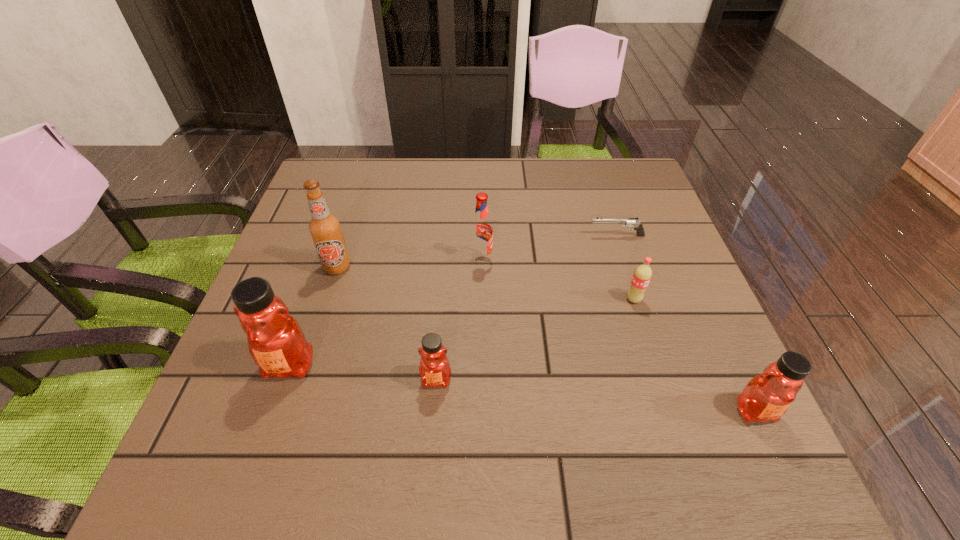
Please mark a free spot for a new honey to balance the arrangement. Please provide its 2D coordinates. Your answer should be formatted as a tuple, i.e. [(x, y)], where the tuple contains the x and y coordinates of a point satisfying the conditions above.

[(591, 395)]